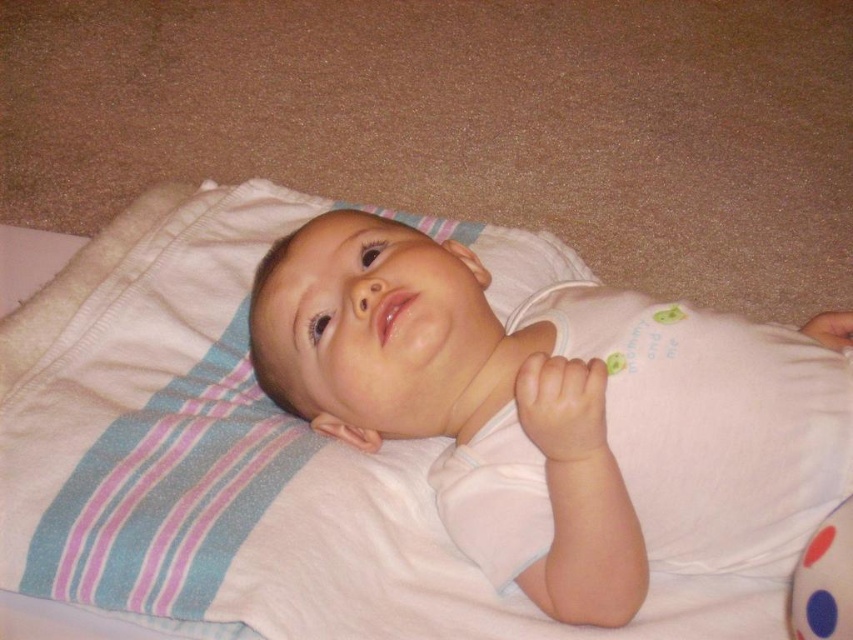
Consider the image. Between white soft pillow at upper center and polka dot fabric ball at lower right, which one is positioned lower?

polka dot fabric ball at lower right

Who is taller, white soft pillow at upper center or polka dot fabric ball at lower right?

white soft pillow at upper center is taller.

Between point (201, 605) and point (817, 531), which one is positioned in front?

Point (201, 605) is more forward.

This screenshot has height=640, width=853. Find the location of `white soft pillow at upper center`. white soft pillow at upper center is located at coordinates (207, 451).

Between white soft pillow at upper center and white soft baby at center, which one appears on the left side from the viewer's perspective?

white soft pillow at upper center is more to the left.

Between white soft pillow at upper center and white soft baby at center, which one appears on the right side from the viewer's perspective?

white soft baby at center

Locate an element on the screen. The height and width of the screenshot is (640, 853). white soft pillow at upper center is located at coordinates (207, 451).

The height and width of the screenshot is (640, 853). What are the coordinates of `white soft baby at center` in the screenshot? It's located at (552, 406).

Is white soft baby at center closer to camera compared to polka dot fabric ball at lower right?

No, it is not.

Locate an element on the screen. Image resolution: width=853 pixels, height=640 pixels. white soft baby at center is located at coordinates (552, 406).